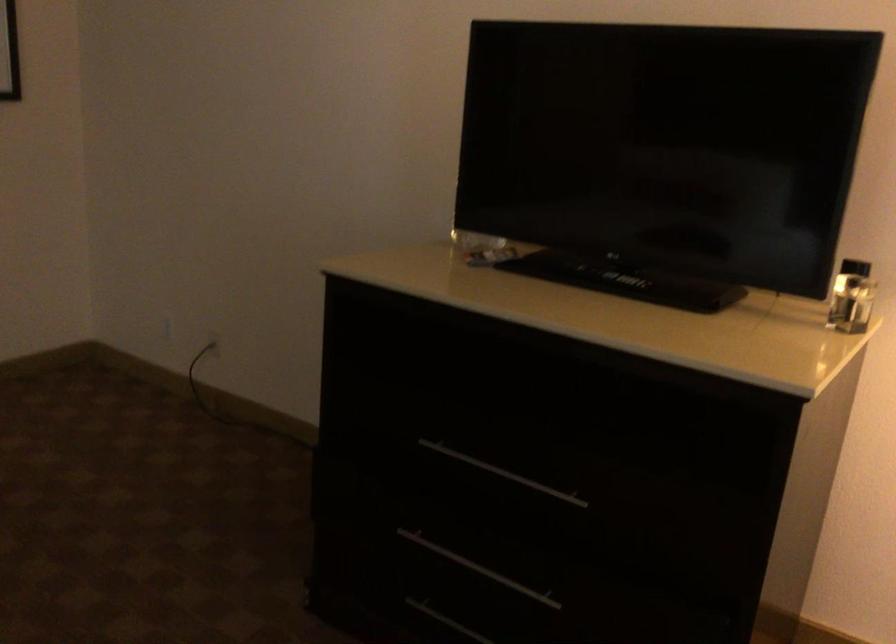
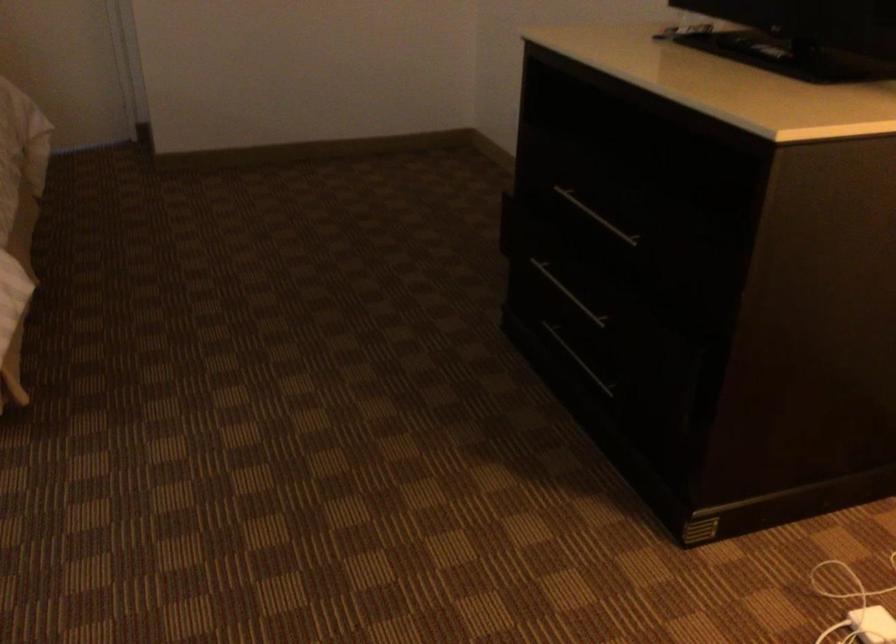
Locate, in the second image, the point that corresponds to point (481, 572) in the first image.

(567, 292)